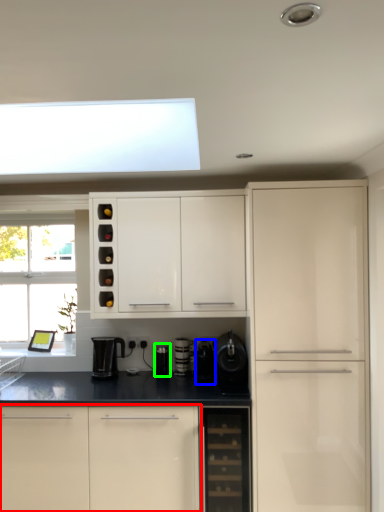
Question: Estimate the real-world distances between objects in this image. Which object is closer to cabinetry (highlighted by a red box), appliance (highlighted by a blue box) or appliance (highlighted by a green box)?

Choices:
 (A) appliance
 (B) appliance

Answer: (A)